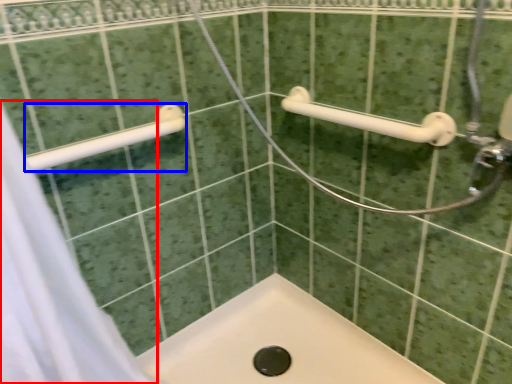
Question: Which point is closer to the camera, shower curtain (highlighted by a red box) or towel rack (highlighted by a blue box)?

Choices:
 (A) shower curtain
 (B) towel rack

Answer: (A)